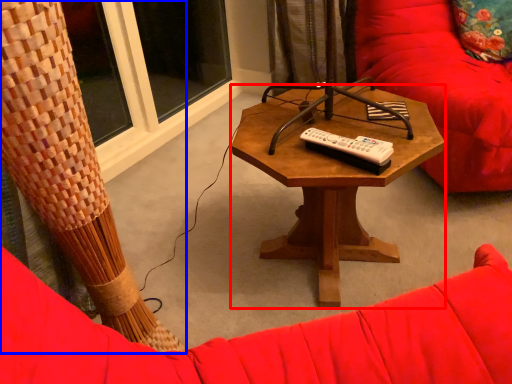
Question: Among these objects, which one is farthest to the camera, coffee table (highlighted by a red box) or curtain (highlighted by a blue box)?

Choices:
 (A) coffee table
 (B) curtain

Answer: (A)